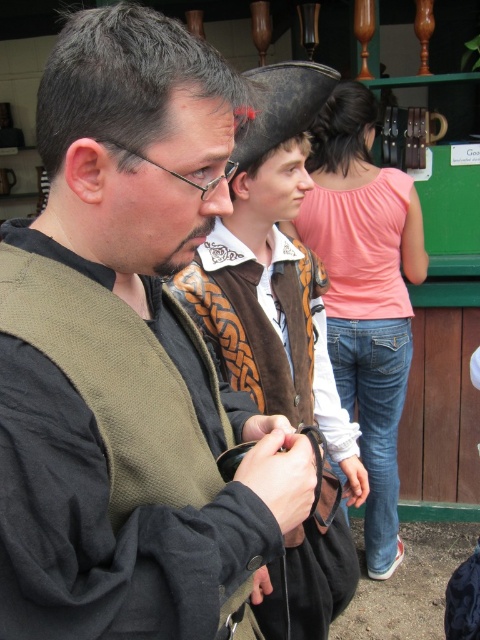
Question: Which of the following is the closest to the observer?

Choices:
 (A) pink cotton shirt at upper center
 (B) shiny black leather cowboy hat at center
 (C) matte brown vest at center

Answer: (C)

Question: Which object is positioned closest to the matte brown vest at center?

Choices:
 (A) pink cotton shirt at upper center
 (B) shiny black leather cowboy hat at center

Answer: (B)

Question: Which of the following is the closest to the observer?

Choices:
 (A) shiny black leather cowboy hat at center
 (B) matte brown vest at center
 (C) pink cotton shirt at upper center

Answer: (B)

Question: Can you confirm if matte brown vest at center is positioned above shiny black leather cowboy hat at center?

Choices:
 (A) yes
 (B) no

Answer: (B)

Question: Is matte brown vest at center to the right of pink cotton shirt at upper center from the viewer's perspective?

Choices:
 (A) no
 (B) yes

Answer: (A)

Question: Is the position of matte brown vest at center less distant than that of pink cotton shirt at upper center?

Choices:
 (A) no
 (B) yes

Answer: (B)